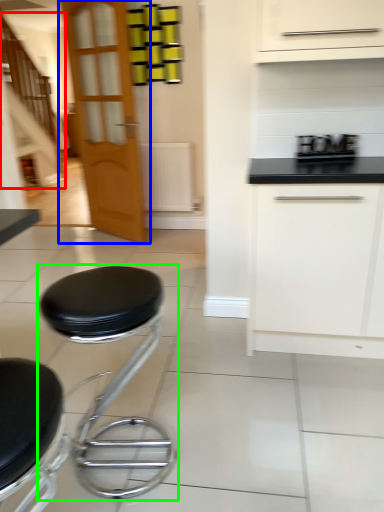
Question: Considering the real-world distances, which object is farthest from stairwell (highlighted by a red box)? door (highlighted by a blue box) or stool (highlighted by a green box)?

Choices:
 (A) door
 (B) stool

Answer: (B)